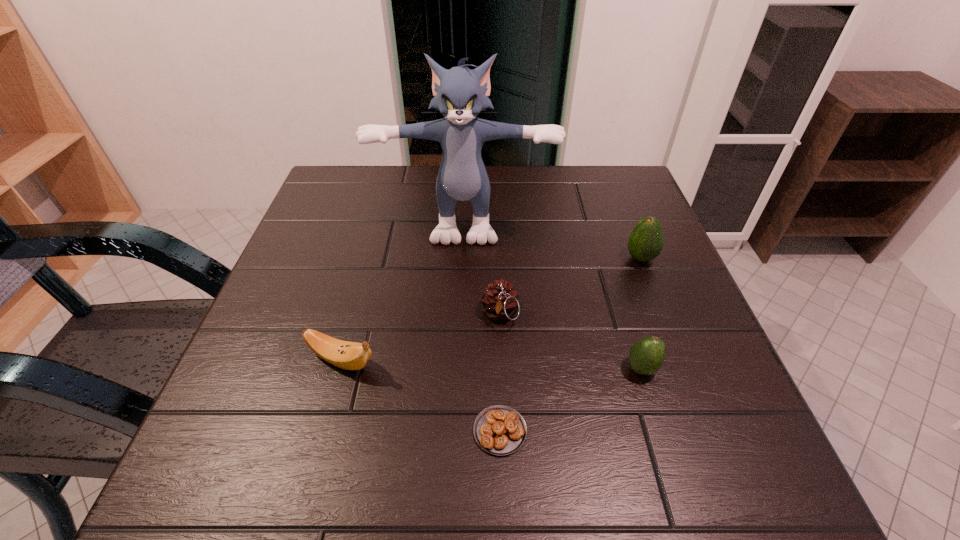
Find the location of `free space between the cat and the shortest object`. free space between the cat and the shortest object is located at coordinates (482, 325).

Find the location of a particular element. The height and width of the screenshot is (540, 960). free space between the taller avocado and the shortest object is located at coordinates (570, 345).

The height and width of the screenshot is (540, 960). Identify the location of vacant area between the nearer avocado and the rightmost object. (x=641, y=314).

The height and width of the screenshot is (540, 960). What are the coordinates of `free space between the shortest object and the cat` in the screenshot? It's located at (482, 325).

Identify the location of free spot between the banana and the pinecone. (420, 338).

You are a GUI agent. You are given a task and a screenshot of the screen. Output one action in this format:
    pyautogui.click(x=<x>, y=<y>)
    Task: Click on the empty space that is in between the second farthest object and the left avocado
    
    Given the screenshot: What is the action you would take?
    click(641, 314)

Identify which object is located as the second nearest to the tallest object. Please provide its 2D coordinates. Your answer should be formatted as a tuple, i.e. [(x, y)], where the tuple contains the x and y coordinates of a point satisfying the conditions above.

[(500, 301)]

Find the location of a particular element. object that stands as the closest to the banana is located at coordinates (500, 430).

You are a GUI agent. You are given a task and a screenshot of the screen. Output one action in this format:
    pyautogui.click(x=<x>, y=<y>)
    Task: Click on the blank area in the image that satisfies the following two spatial constraints: 1. on the front-facing side of the nearer avocado; 2. on the right side of the tallest object
    
    Given the screenshot: What is the action you would take?
    (x=459, y=368)

Identify the location of free location that satisfies the following two spatial constraints: 1. on the back side of the second object from right to left; 2. on the right side of the nearest object. (498, 368).